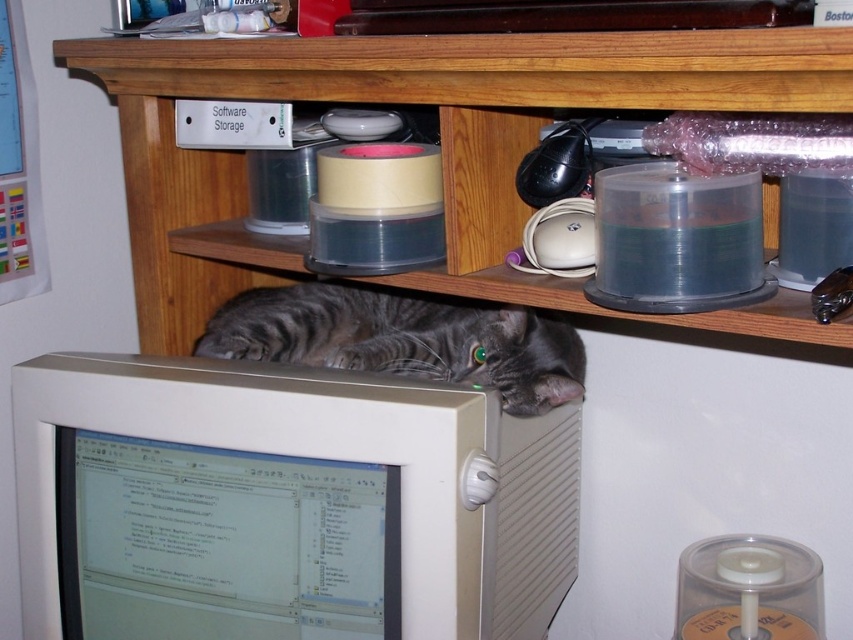
You are standing in front of the scene described. You want to place a new item on the wooden shelf at center. Where exactly should you place it to match the existing arrangement?

The wooden shelf at center is located at the coordinates 0.225 on the x axis and 0.517 on the y axis, so place the new item at those coordinates to maintain alignment with the existing items.

You are organizing a small desk space and need to know if the beige plastic monitor at center can fit on the wooden shelf at center. Based on their sizes, can it be placed there?

The beige plastic monitor at center has a smaller size compared to wooden shelf at center, so it can fit on the shelf.